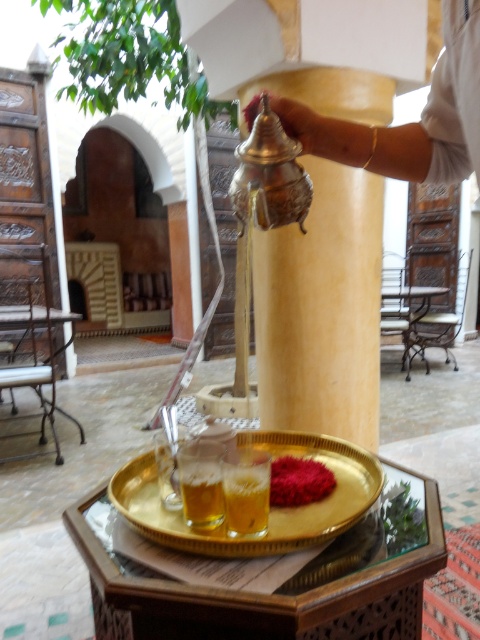
You are arranging items on a tray and need to place both the translucent glass at lower center and the smooth red powder at center. Given their sizes, which item can fit into a 10 cm wide space?

The translucent glass at lower center has a width less than the smooth red powder at center, so it can fit into the 10 cm wide space.

You are a visitor in this traditional space and want to place a small decoration on the shorter object between the metallic gold pillar at center and the gold metallic tray at center. Which object should you choose?

The gold metallic tray at center is shorter than the metallic gold pillar at center, so you should place the decoration on the gold metallic tray at center.